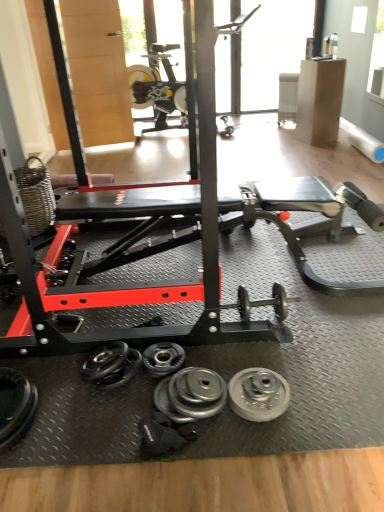
Where is `vacant space behind silver metallic dumbbell at center, the second dumbbell when ordered from left to right`? vacant space behind silver metallic dumbbell at center, the second dumbbell when ordered from left to right is located at coordinates (171, 333).